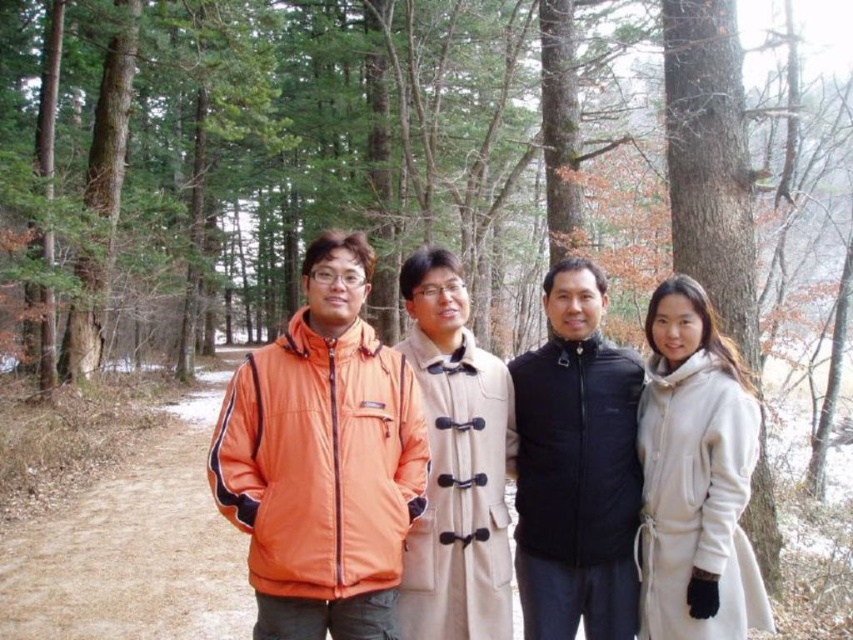
From the picture: Does black quilted vest at center appear on the left side of beige wool coat at right?

Correct, you'll find black quilted vest at center to the left of beige wool coat at right.

Describe the element at coordinates (576, 467) in the screenshot. I see `black quilted vest at center` at that location.

Locate an element on the screen. This screenshot has width=853, height=640. black quilted vest at center is located at coordinates (576, 467).

Is point (403, 444) closer to camera compared to point (659, 442)?

Yes, it is.

Does orange fabric jacket at center come in front of beige wool coat at right?

Yes, orange fabric jacket at center is in front of beige wool coat at right.

Which is behind, point (347, 444) or point (741, 378)?

Point (741, 378)

Locate an element on the screen. orange fabric jacket at center is located at coordinates (323, 458).

Who is taller, orange nylon jacket at center or beige wool coat at right?

With more height is beige wool coat at right.

Between point (316, 504) and point (688, 547), which one is positioned behind?

The point (688, 547) is behind.

At what (x,y) coordinates should I click in order to perform the action: click on orange nylon jacket at center. Please return your answer as a coordinate pair (x, y). This screenshot has height=640, width=853. Looking at the image, I should click on (357, 451).